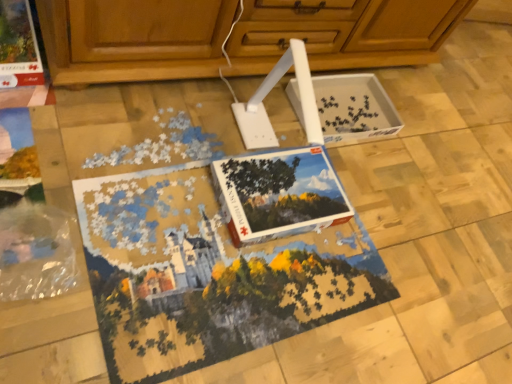
You are a GUI agent. You are given a task and a screenshot of the screen. Output one action in this format:
    pyautogui.click(x=<x>, y=<y>)
    Task: Click on the free spot below matte cardboard magazine at upper left, which appears as the 1th magazine when viewed from the top (from a real-world perspective)
    The image size is (512, 384).
    Given the screenshot: What is the action you would take?
    pyautogui.click(x=21, y=53)